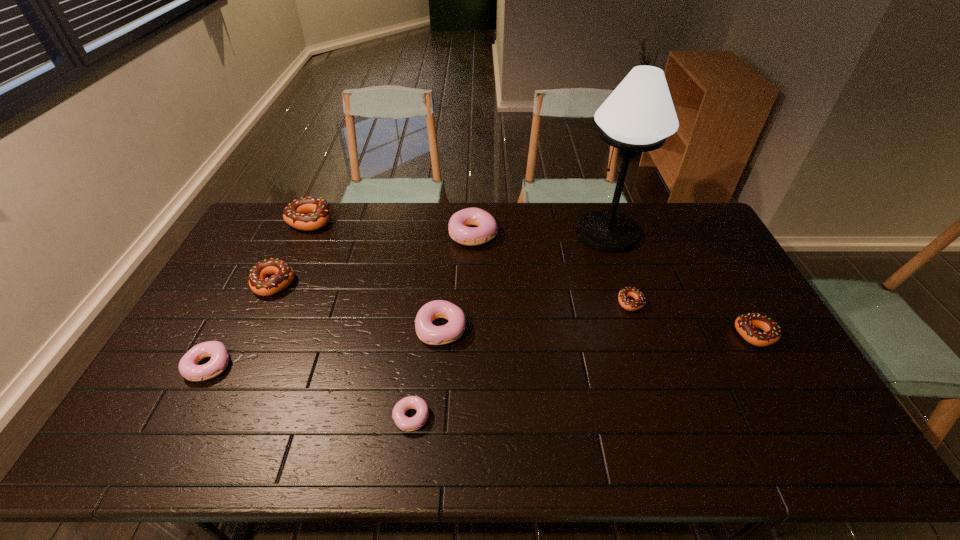
Where is `vacant area in the image that satisfies the following two spatial constraints: 1. on the front side of the farthest brown doughnut; 2. on the left side of the rightmost doughnut`? vacant area in the image that satisfies the following two spatial constraints: 1. on the front side of the farthest brown doughnut; 2. on the left side of the rightmost doughnut is located at coordinates (257, 334).